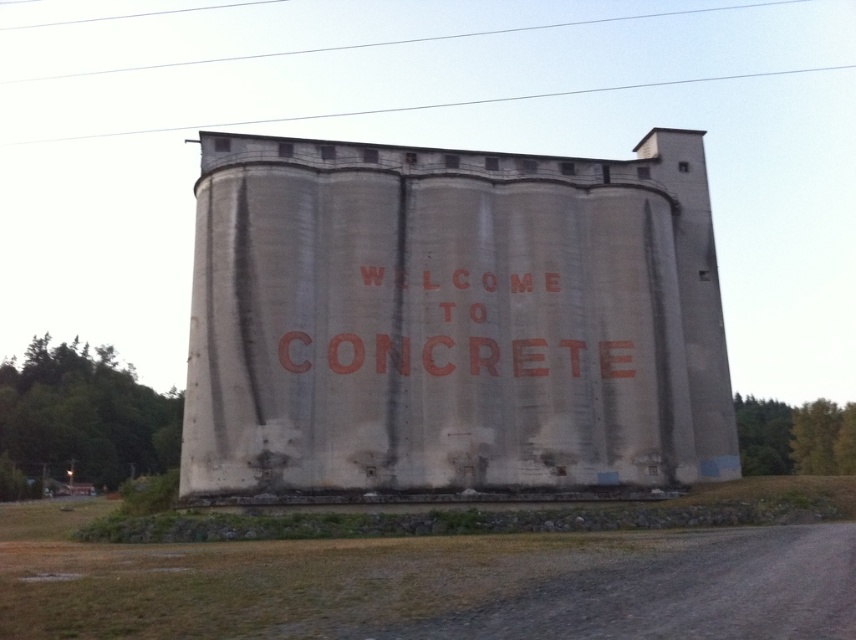
You are standing at the camera position and want to reach the point marked at coordinates (214, 369). If your walking speed is 3 feet per second, how many seconds will it take you to reach the point?

The distance between you and the point marked at coordinates (214, 369) is 165.38 feet. At a walking speed of 3 feet per second, it would take approximately 55.13 seconds to reach the point.

You are standing in front of the gray concrete silo at center and looking towards the smooth wire at upper center. Which object is closer to your right side?

The gray concrete silo at center is positioned on the right side of smooth wire at upper center, so when standing in front of the gray concrete silo at center and looking towards the smooth wire at upper center, the gray concrete silo at center is closer to your right side.